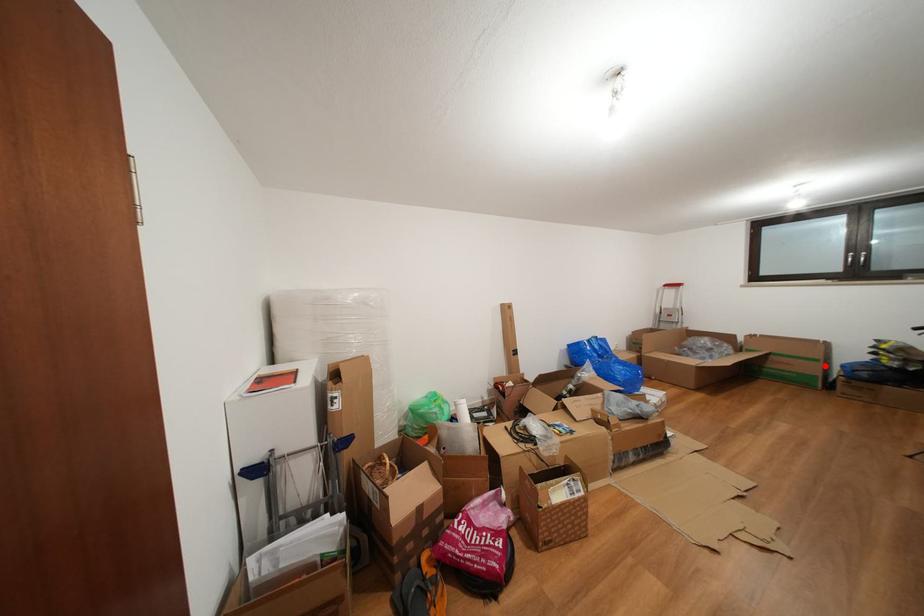
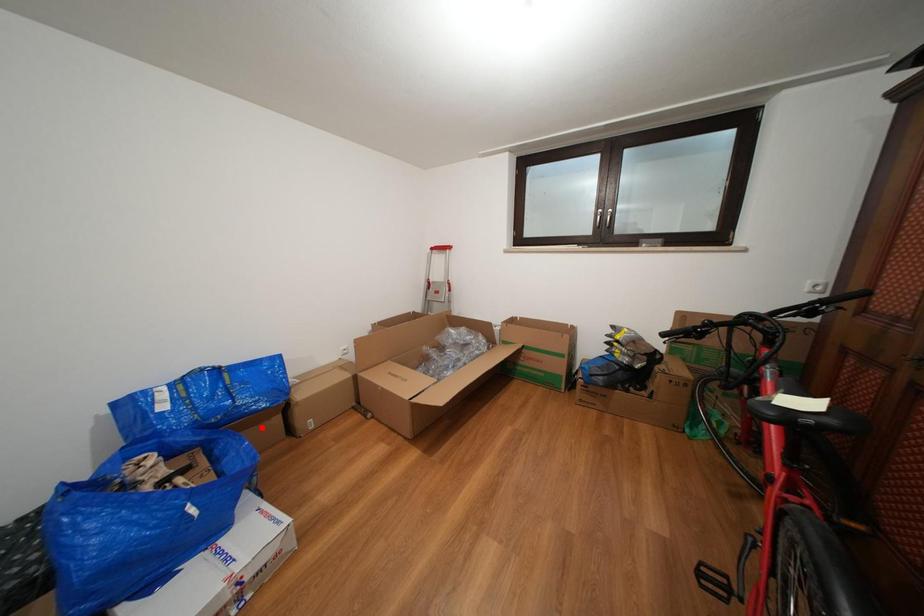
I am providing you with two images of the same scene from different viewpoints. A red point is marked on the first image and another point is marked on the second image. Are the points marked in image1 and image2 representing the same 3D position?

No